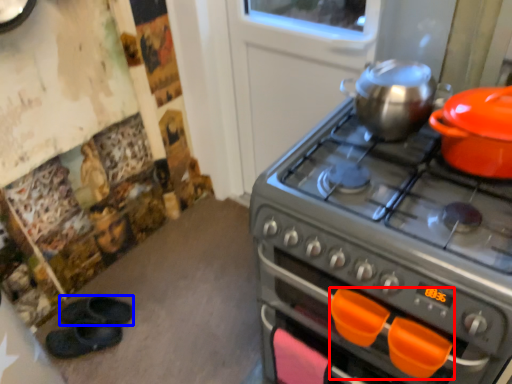
Question: Which of the following is the closest to the observer, handle (highlighted by a red box) or footwear (highlighted by a blue box)?

Choices:
 (A) handle
 (B) footwear

Answer: (A)